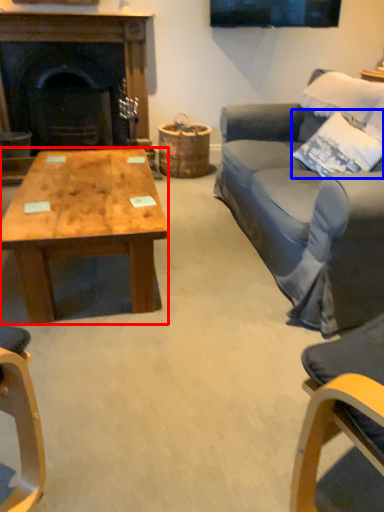
Question: Which of the following is the closest to the observer, coffee table (highlighted by a red box) or pillow (highlighted by a blue box)?

Choices:
 (A) coffee table
 (B) pillow

Answer: (A)